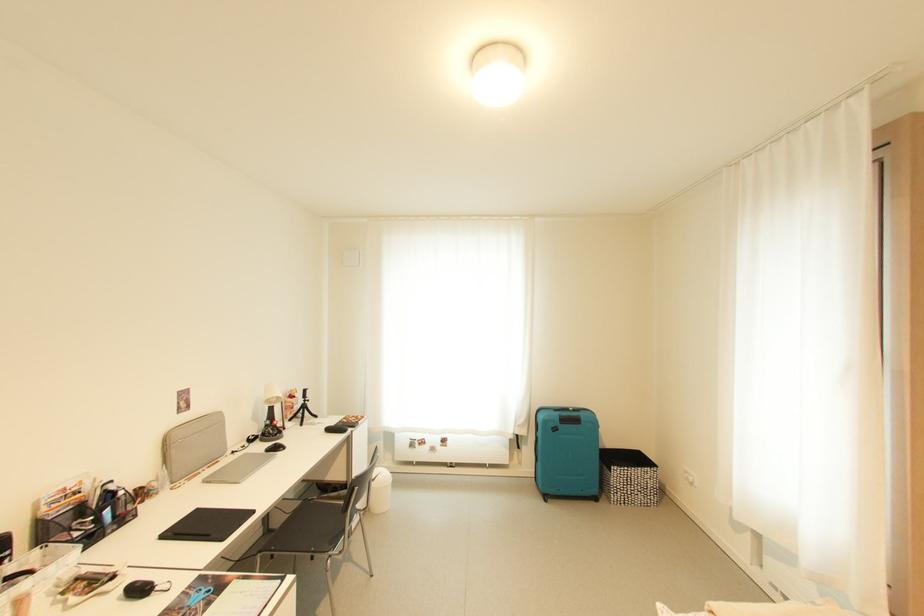
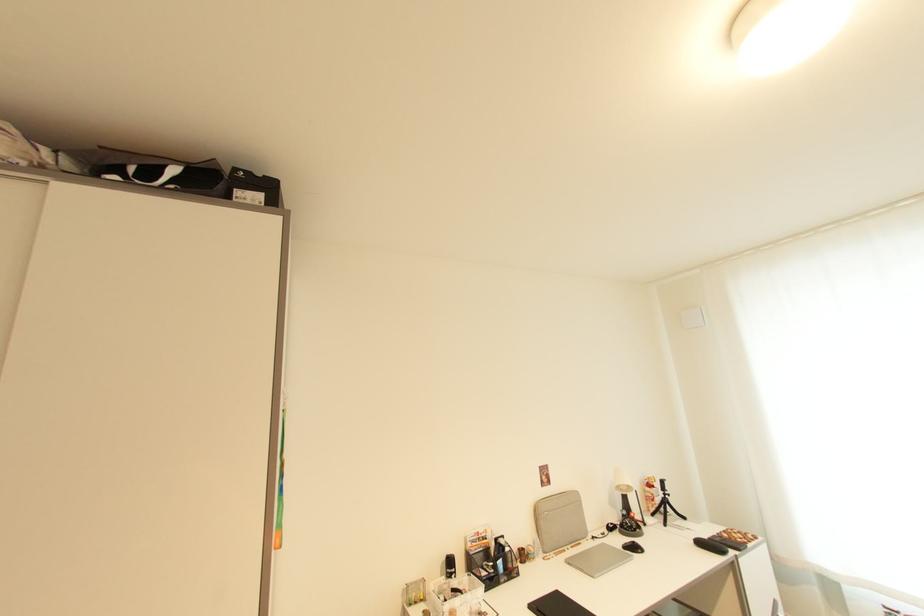
Locate, in the second image, the point that corresponds to (282,450) in the first image.

(639, 549)